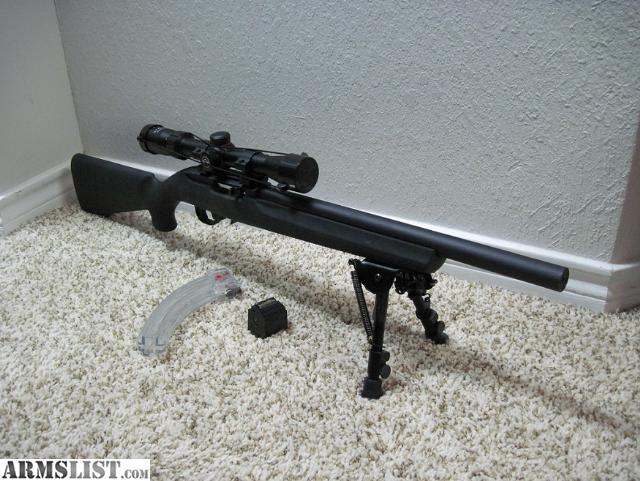
The image size is (640, 481). Identify the location of painted drywall behind gun. (134, 45).